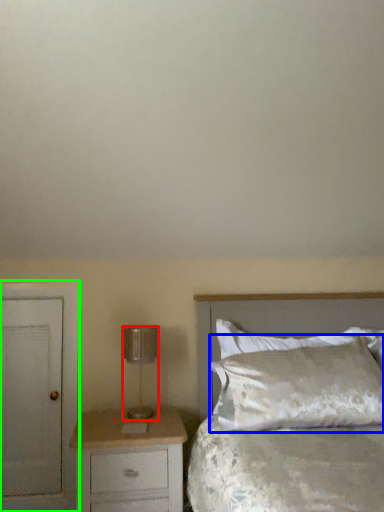
Question: Which is nearer to the lamp (highlighted by a red box)? pillow (highlighted by a blue box) or armoire (highlighted by a green box).

Choices:
 (A) pillow
 (B) armoire

Answer: (B)